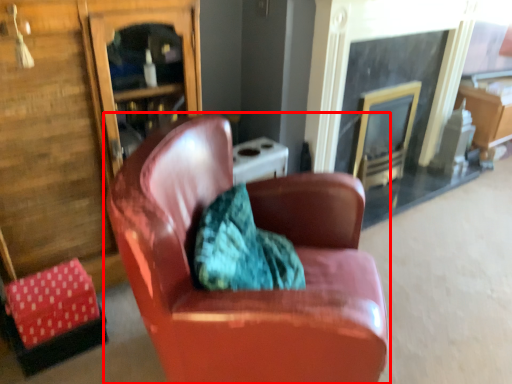
Question: From the image, what is the correct spatial relationship of chair (annotated by the red box) in relation to fireplace?

Choices:
 (A) right
 (B) left

Answer: (B)